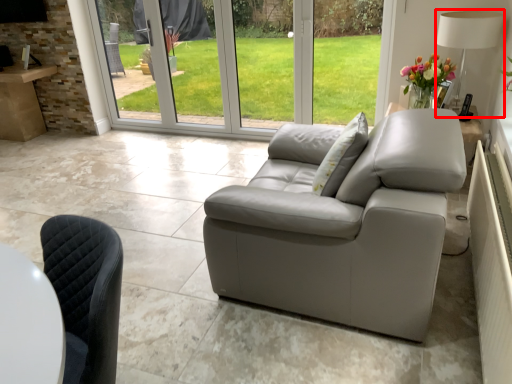
Question: From the image's perspective, considering the relative positions of lamp (annotated by the red box) and pillow in the image provided, where is lamp (annotated by the red box) located with respect to the staircase?

Choices:
 (A) above
 (B) below

Answer: (A)